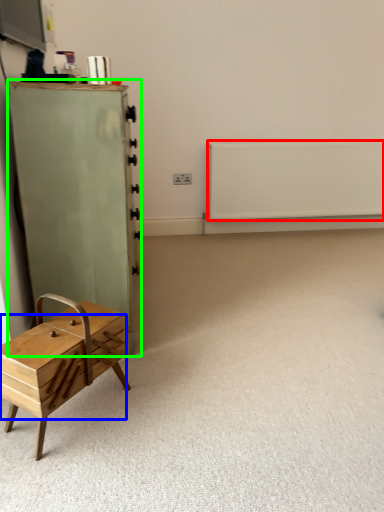
Question: Which object is the closest to the radiator (highlighted by a red box)? Choose among these: drawer (highlighted by a blue box) or chest of drawers (highlighted by a green box).

Choices:
 (A) drawer
 (B) chest of drawers

Answer: (B)